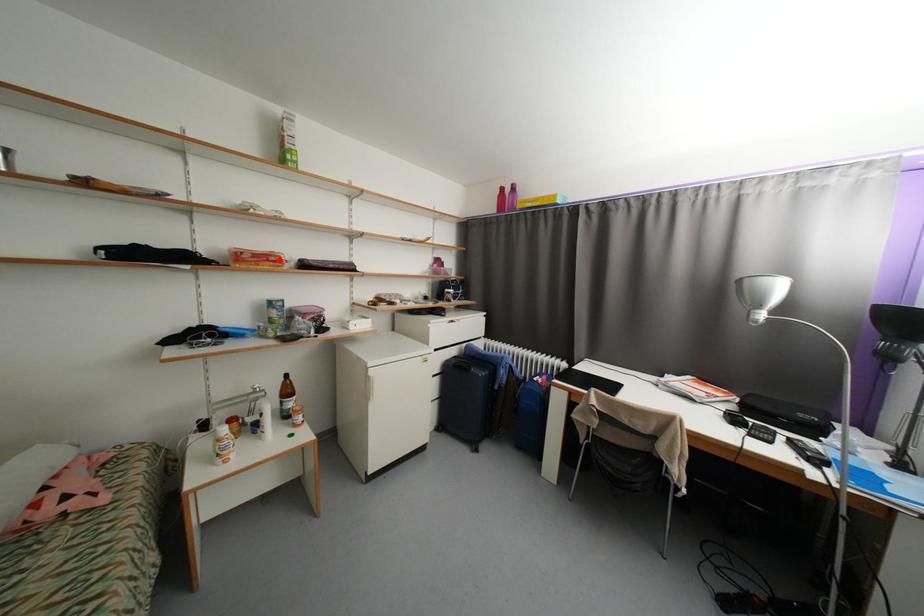
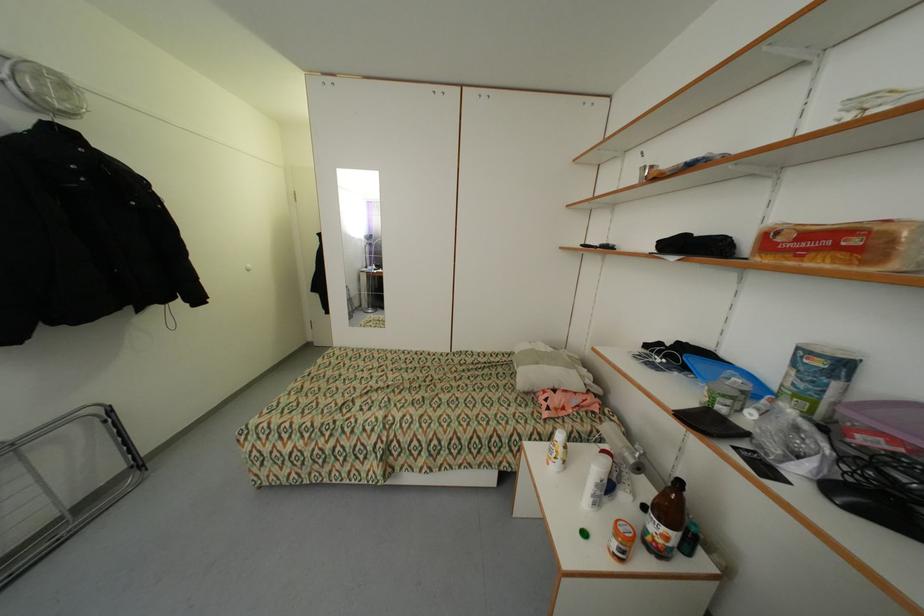
Find the pixel in the second image that matches the highlighted location in the first image.

(860, 241)